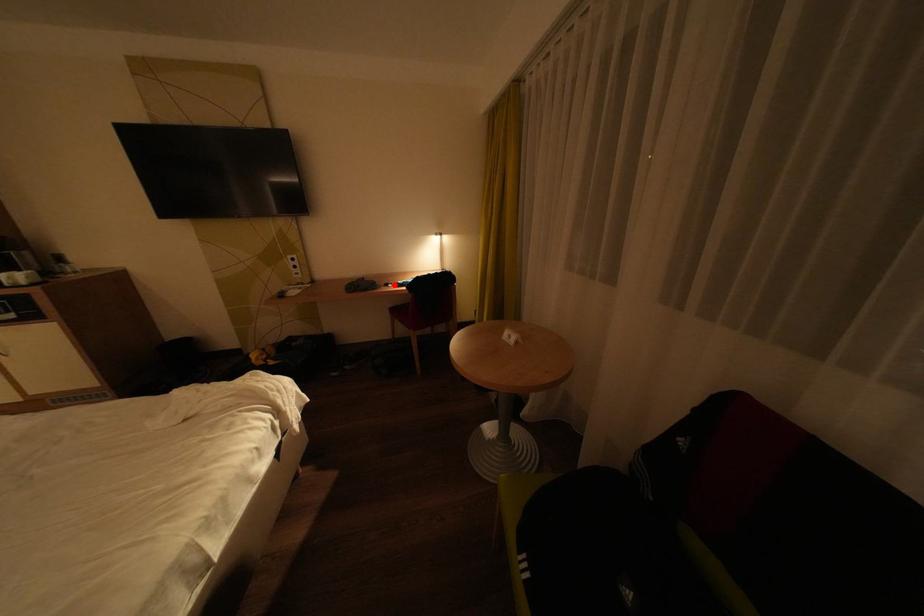
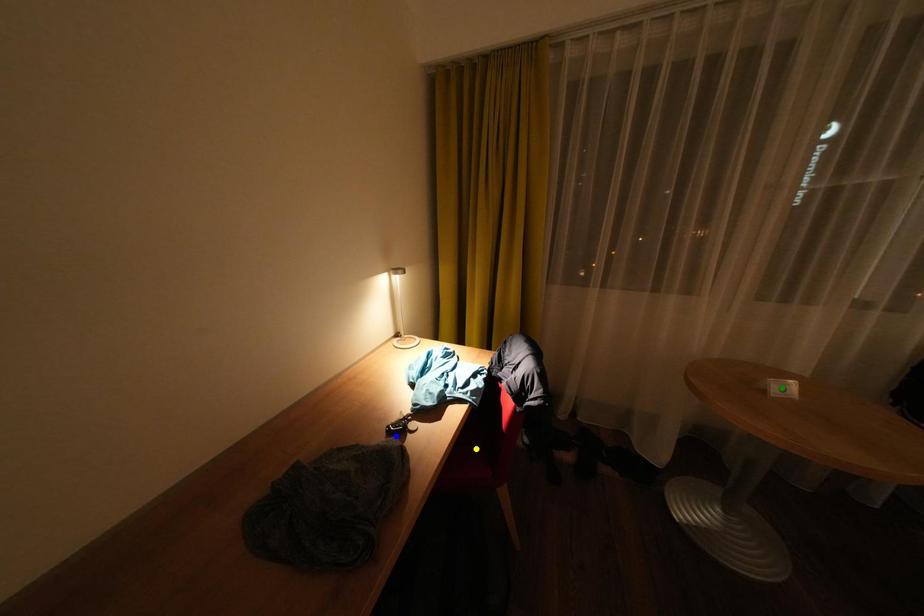
Question: I am providing you with two images of the same scene from different viewpoints. A red point is marked on the first image. You are given multiple points on the second image. Which point in image 2 represents the same 3d spot as the red point in image 1?

Choices:
 (A) green point
 (B) yellow point
 (C) blue point

Answer: (C)